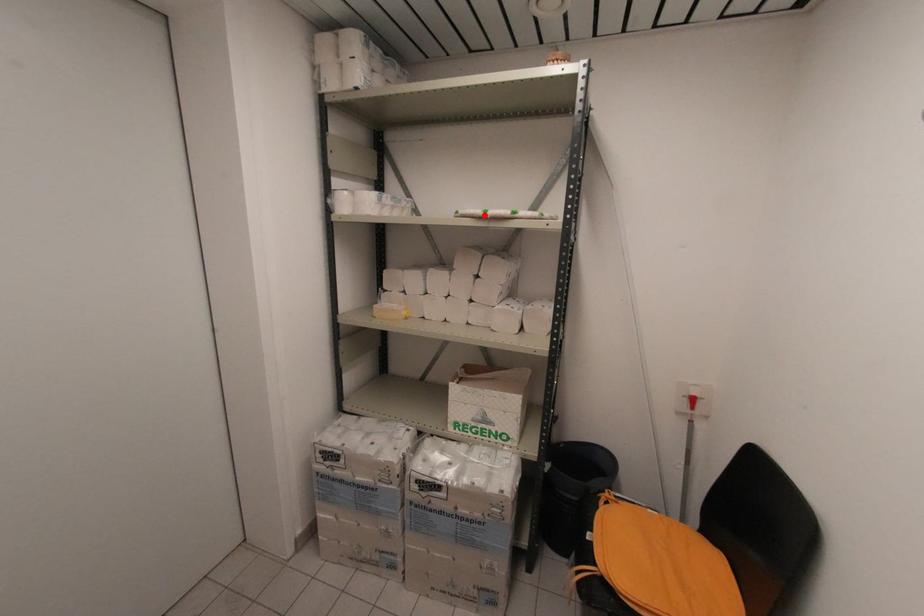
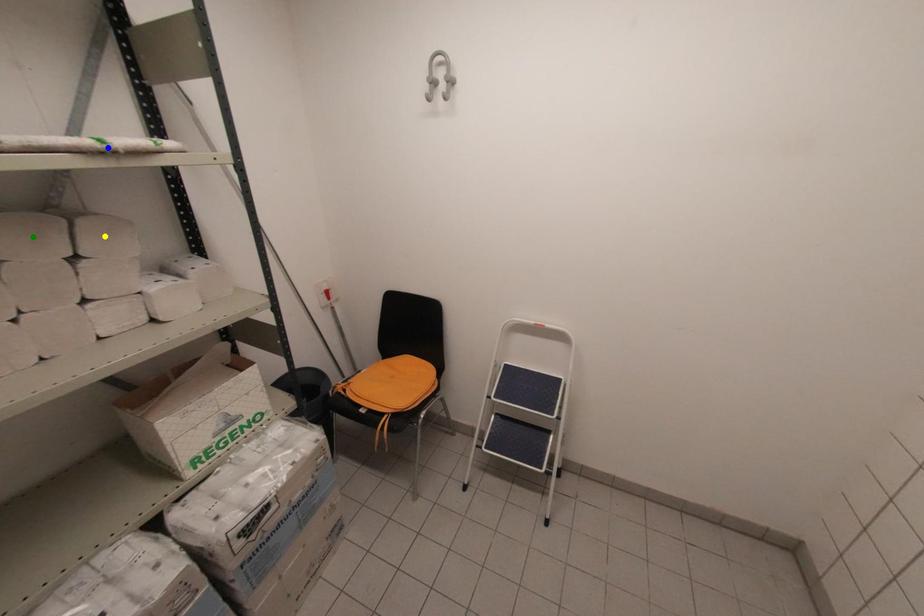
Question: I am providing you with two images of the same scene from different viewpoints. A red point is marked on the first image. You are given multiple points on the second image. Which point in image 2 is actually the same real-world point as the red point in image 1?

Choices:
 (A) blue point
 (B) yellow point
 (C) green point

Answer: (A)